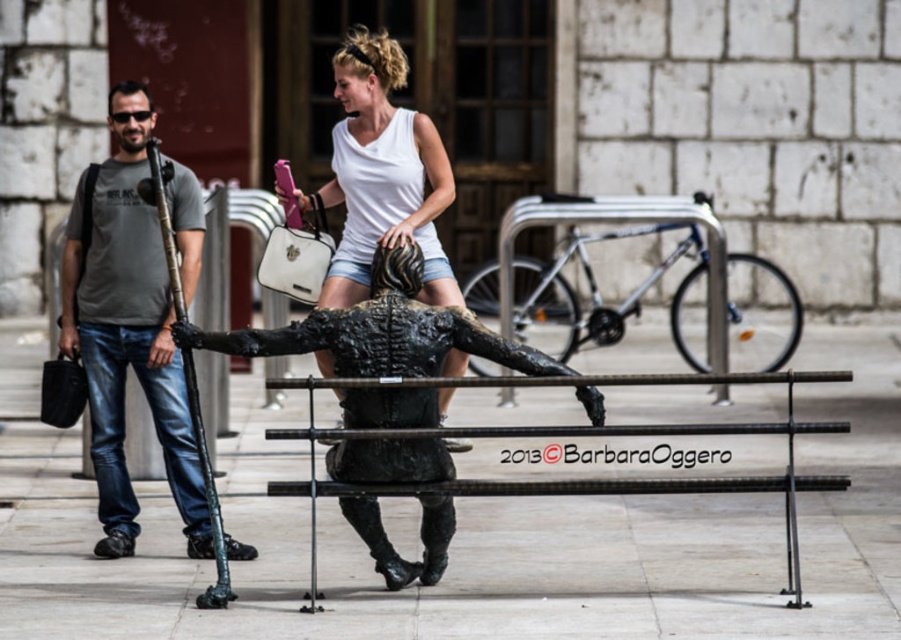
Is gray matte t-shirt at left taller than black matte bronze sculpture at center?

Yes.

Is gray matte t-shirt at left below black matte bronze sculpture at center?

Yes, gray matte t-shirt at left is below black matte bronze sculpture at center.

Which is in front, point (132, 540) or point (337, 314)?

Point (337, 314)

Where is `gray matte t-shirt at left`? The image size is (901, 640). gray matte t-shirt at left is located at coordinates (128, 332).

Measure the distance between point (470,349) and camera.

They are 34.03 meters apart.

Is the position of black matte bronze sculpture at center more distant than that of black metal bench at center?

Yes, it is behind black metal bench at center.

Is point (426, 413) more distant than point (283, 429)?

No.

Find the location of a particular element. The height and width of the screenshot is (640, 901). black matte bronze sculpture at center is located at coordinates (380, 330).

Can you confirm if gray matte t-shirt at left is positioned above white matte tank top at center?

No, gray matte t-shirt at left is not above white matte tank top at center.

Who is more distant from viewer, (80, 291) or (431, 202)?

Point (431, 202)

Find the location of a particular element. gray matte t-shirt at left is located at coordinates (128, 332).